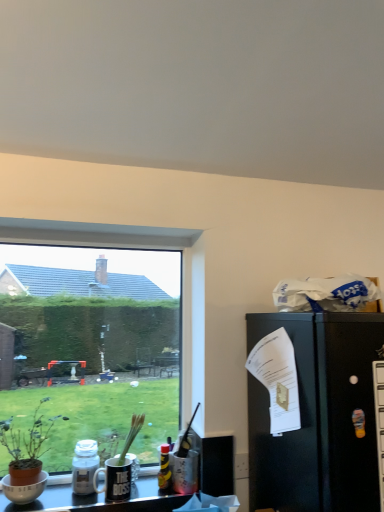
Question: Relative to transparent glass window at lower left, is translucent plastic bottle at center, arranged as the 1th bottle when viewed from the right, in front or behind?

Choices:
 (A) behind
 (B) front

Answer: (A)

Question: In terms of height, does translucent plastic bottle at center, placed as the second bottle when sorted from left to right, look taller or shorter compared to transparent glass window at lower left?

Choices:
 (A) tall
 (B) short

Answer: (B)

Question: Based on their relative distances, which object is farther from the metallic silver desk at lower center?

Choices:
 (A) black matte refrigerator at right
 (B) matte white bowl at lower left
 (C) brown terracotta pot at left
 (D) translucent glass bottle at lower left, the 1th bottle viewed from the left
 (E) translucent plastic bottle at center, arranged as the 1th bottle when viewed from the right

Answer: (A)

Question: Estimate the real-world distances between objects in this image. Which object is closer to the black matte refrigerator at right?

Choices:
 (A) translucent plastic bottle at center, placed as the second bottle when sorted from left to right
 (B) matte white bowl at lower left
 (C) transparent glass window at lower left
 (D) translucent glass bottle at lower left, the 1th bottle viewed from the left
 (E) metallic silver desk at lower center

Answer: (A)